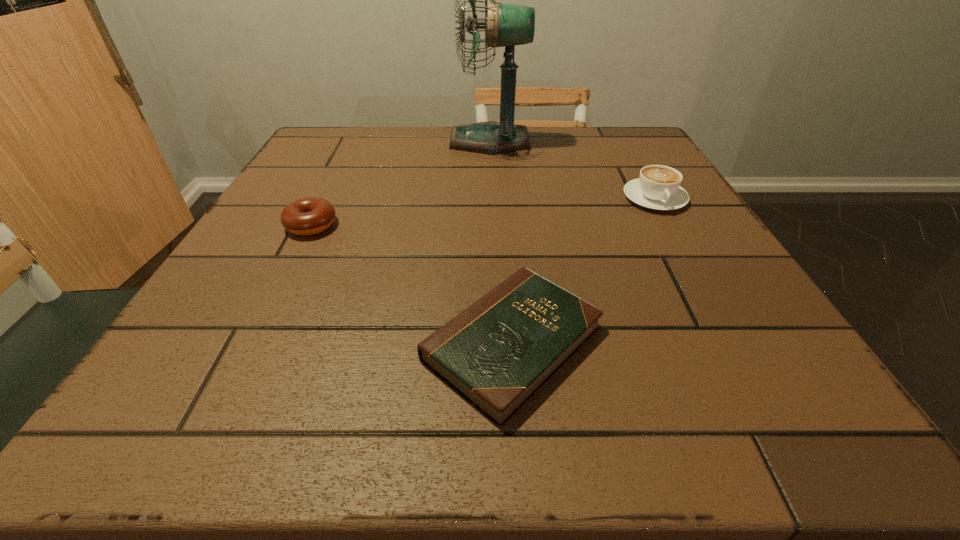
You are a GUI agent. You are given a task and a screenshot of the screen. Output one action in this format:
    pyautogui.click(x=<x>, y=<y>)
    Task: Click on the blank area located in front of the farthest object where the wind blows
    The image size is (960, 540).
    Given the screenshot: What is the action you would take?
    pyautogui.click(x=314, y=141)

The width and height of the screenshot is (960, 540). What are the coordinates of `free spot located on the side of the third shortest object with the handle` in the screenshot? It's located at (679, 240).

Image resolution: width=960 pixels, height=540 pixels. I want to click on vacant space located on the front of the third tallest object, so click(287, 273).

You are a GUI agent. You are given a task and a screenshot of the screen. Output one action in this format:
    pyautogui.click(x=<x>, y=<y>)
    Task: Click on the vacant space located on the right of the shortest object
    Image resolution: width=960 pixels, height=540 pixels.
    Given the screenshot: What is the action you would take?
    pyautogui.click(x=783, y=343)

The width and height of the screenshot is (960, 540). Identify the location of object present at the far edge. (506, 25).

Locate an element on the screen. The height and width of the screenshot is (540, 960). object that is at the near edge is located at coordinates (497, 353).

Find the location of a particular element. Image resolution: width=960 pixels, height=540 pixels. object present at the left edge is located at coordinates (307, 216).

At what (x,y) coordinates should I click in order to perform the action: click on object located at the right edge. Please return your answer as a coordinate pair (x, y). Looking at the image, I should click on (658, 187).

Find the location of a particular element. The image size is (960, 540). vacant area at the far edge is located at coordinates (588, 155).

Where is `vacant space at the near edge of the desktop`? This screenshot has width=960, height=540. vacant space at the near edge of the desktop is located at coordinates (389, 411).